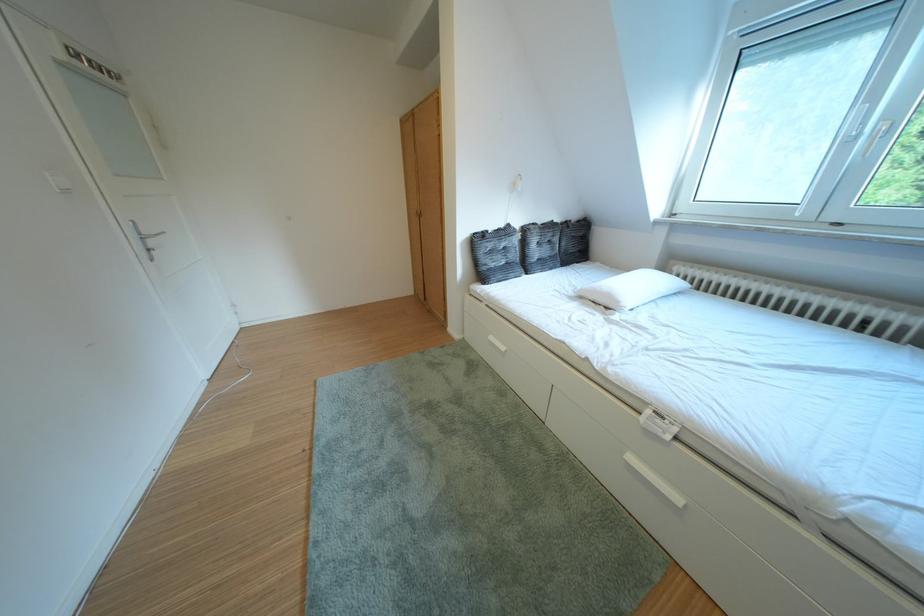
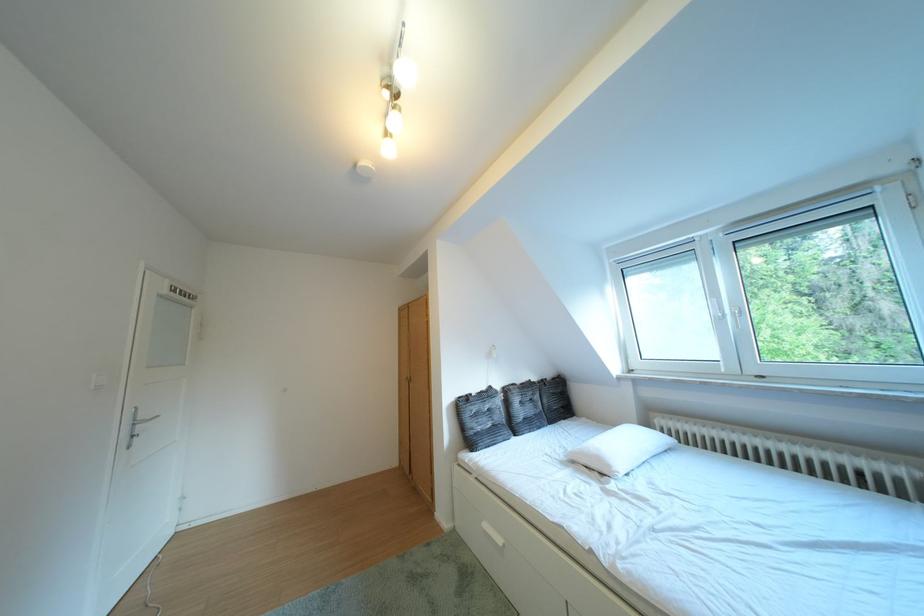
Find the pixel in the second image that matches (141,230) in the first image.

(141, 418)